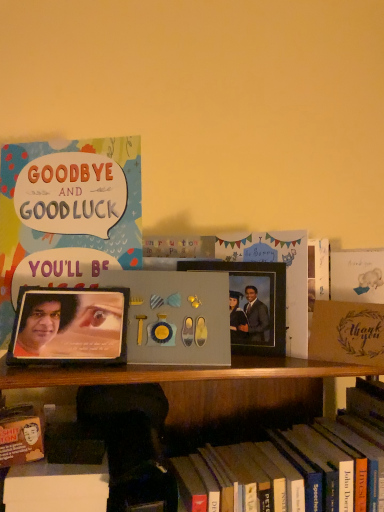
Question: Does brown textured paper at right contain matte cardstock card at upper left, arranged as the second book when ordered from the bottom?

Choices:
 (A) yes
 (B) no

Answer: (B)

Question: From a real-world perspective, is brown textured paper at right on top of matte cardstock card at upper left, which ranks as the second book in right-to-left order?

Choices:
 (A) yes
 (B) no

Answer: (B)

Question: Is brown textured paper at right smaller than matte cardstock card at upper left, which ranks as the second book in right-to-left order?

Choices:
 (A) yes
 (B) no

Answer: (A)

Question: From a real-world perspective, is brown textured paper at right positioned under matte cardstock card at upper left, which ranks as the second book in right-to-left order, based on gravity?

Choices:
 (A) no
 (B) yes

Answer: (B)

Question: Is brown textured paper at right completely or partially outside of matte cardstock card at upper left, arranged as the second book when ordered from the bottom?

Choices:
 (A) no
 (B) yes

Answer: (B)

Question: In terms of width, does matte cardstock card at upper left, which is the first book from top to bottom, look wider or thinner when compared to metallic photo frame at center, which is the 1th picture frame in right-to-left order?

Choices:
 (A) thin
 (B) wide

Answer: (B)

Question: Would you say matte cardstock card at upper left, which is the 1th book in left-to-right order, is to the left or to the right of metallic photo frame at center, acting as the first picture frame starting from the back, in the picture?

Choices:
 (A) left
 (B) right

Answer: (A)

Question: Would you say matte cardstock card at upper left, which is the 1th book in left-to-right order, is inside or outside metallic photo frame at center, acting as the first picture frame starting from the back?

Choices:
 (A) inside
 (B) outside

Answer: (B)

Question: Considering the positions of matte cardstock card at upper left, which is the first book from top to bottom, and metallic photo frame at center, acting as the first picture frame starting from the back, in the image, is matte cardstock card at upper left, which is the first book from top to bottom, taller or shorter than metallic photo frame at center, acting as the first picture frame starting from the back,?

Choices:
 (A) short
 (B) tall

Answer: (B)

Question: Considering the positions of point (44, 335) and point (168, 397), is point (44, 335) closer or farther from the camera than point (168, 397)?

Choices:
 (A) closer
 (B) farther

Answer: (A)

Question: From a real-world perspective, is matte black picture frame at left, which appears as the 2th picture frame when viewed from the back, above or below hardcover book at lower center, which is the 2th book in top-to-bottom order?

Choices:
 (A) above
 (B) below

Answer: (A)

Question: Is matte black picture frame at left, positioned as the 1th picture frame in left-to-right order, inside the boundaries of hardcover book at lower center, which is the 1th book in right-to-left order, or outside?

Choices:
 (A) inside
 (B) outside

Answer: (B)

Question: Would you say matte black picture frame at left, which appears as the 2th picture frame when viewed from the back, is to the left or to the right of hardcover book at lower center, which is the 1th book in right-to-left order, in the picture?

Choices:
 (A) left
 (B) right

Answer: (A)

Question: Looking at their shapes, would you say hardcover book at lower center, acting as the 2th book starting from the left, is wider or thinner than metallic photo frame at center, the second picture frame from the front?

Choices:
 (A) wide
 (B) thin

Answer: (A)

Question: Is hardcover book at lower center, which is the 2th book in top-to-bottom order, bigger or smaller than metallic photo frame at center, the second picture frame from the front?

Choices:
 (A) small
 (B) big

Answer: (B)